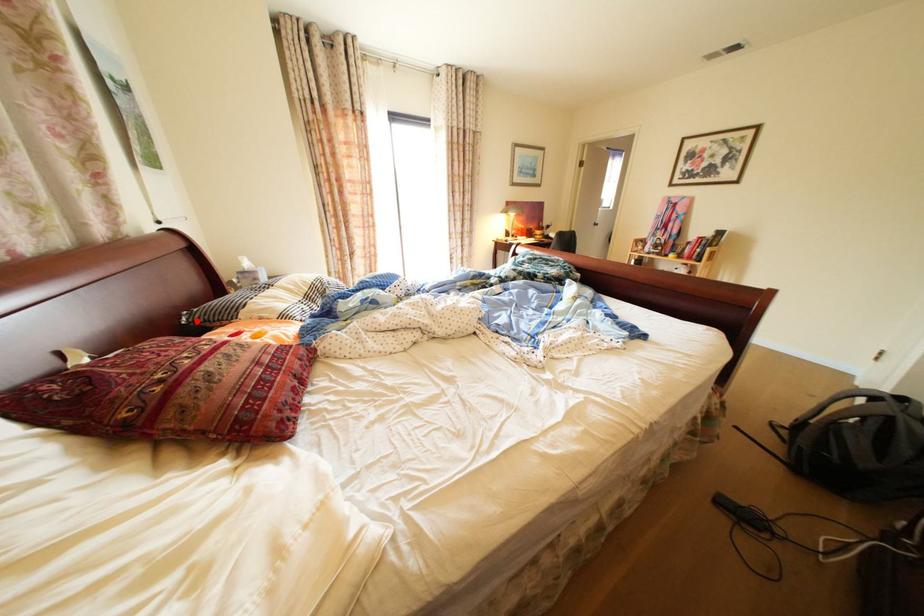
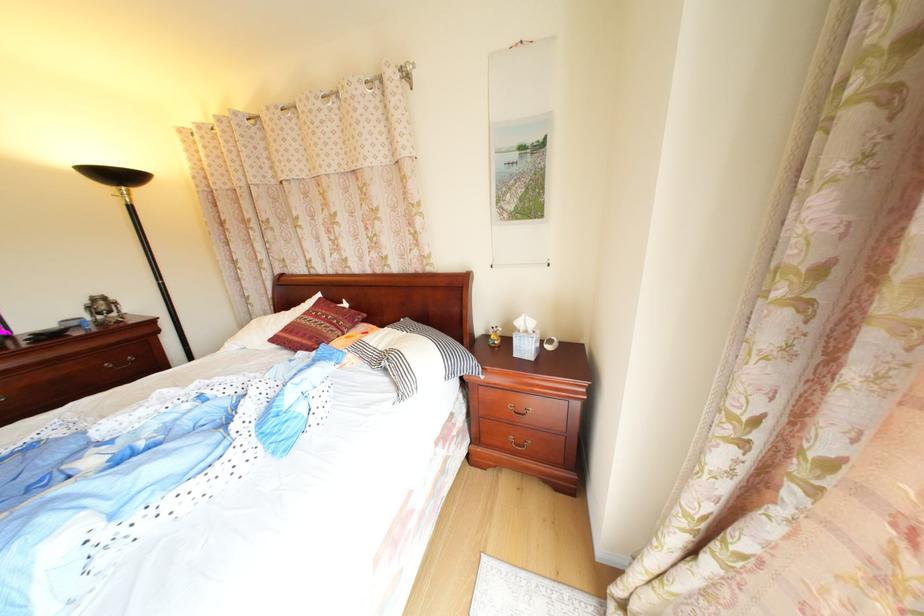
Where in the second image is the point corresponding to the highlighted location from the first image?

(415, 322)